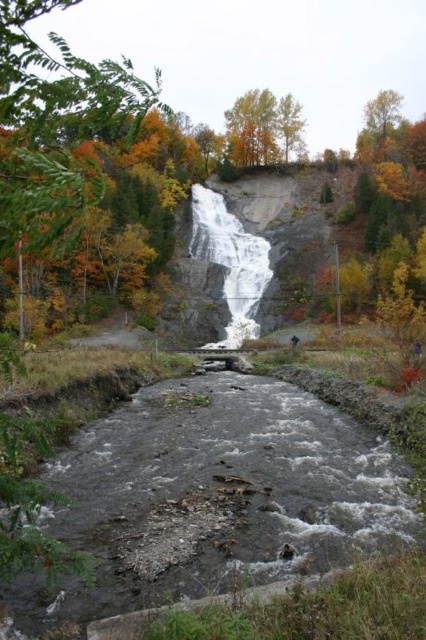
Question: Does gray rocky stream at center have a larger size compared to gray rock waterfall at center?

Choices:
 (A) no
 (B) yes

Answer: (A)

Question: Which object appears closest to the camera in this image?

Choices:
 (A) yellow-green leaves at upper center
 (B) gray rocky stream at center

Answer: (B)

Question: Which of the following is the farthest from the observer?

Choices:
 (A) (241, 316)
 (B) (154, 442)
 (C) (241, 116)

Answer: (C)

Question: Observing the image, what is the correct spatial positioning of gray rocky stream at center in reference to gray rock waterfall at center?

Choices:
 (A) above
 (B) below

Answer: (B)

Question: Estimate the real-world distances between objects in this image. Which object is farther from the gray rocky stream at center?

Choices:
 (A) gray rock waterfall at center
 (B) yellow-green leaves at upper center

Answer: (B)

Question: Does gray rocky stream at center appear on the right side of gray rock waterfall at center?

Choices:
 (A) no
 (B) yes

Answer: (A)